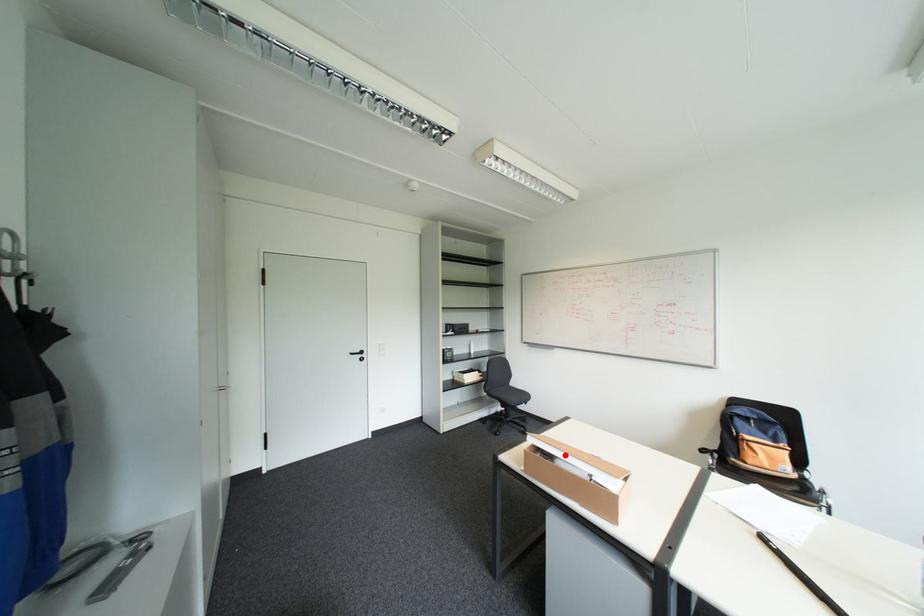
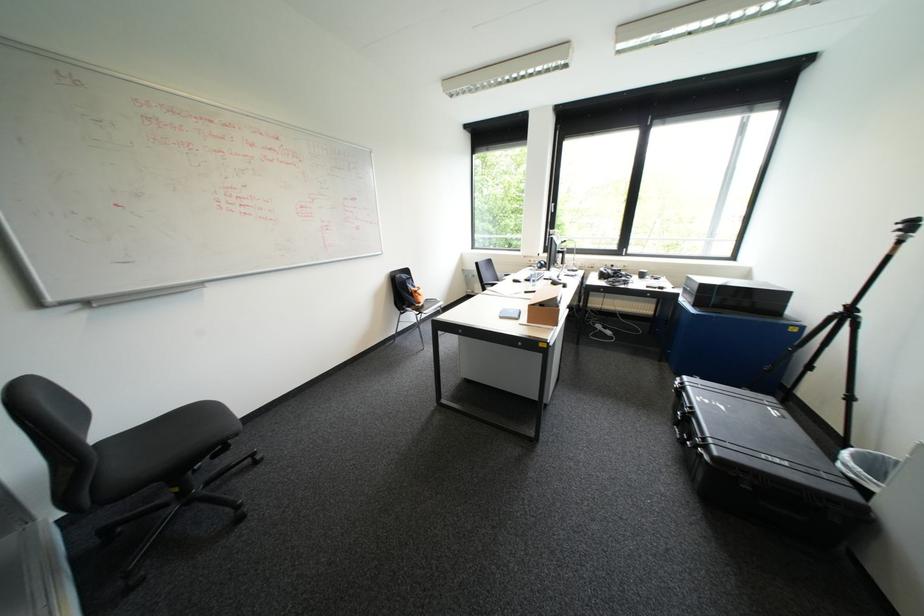
Question: I am providing you with two images of the same scene from different viewpoints. A red point is marked on the first image. At the location where the point appears in image 1, is it still visible in image 2?

Choices:
 (A) Yes
 (B) No

Answer: (B)